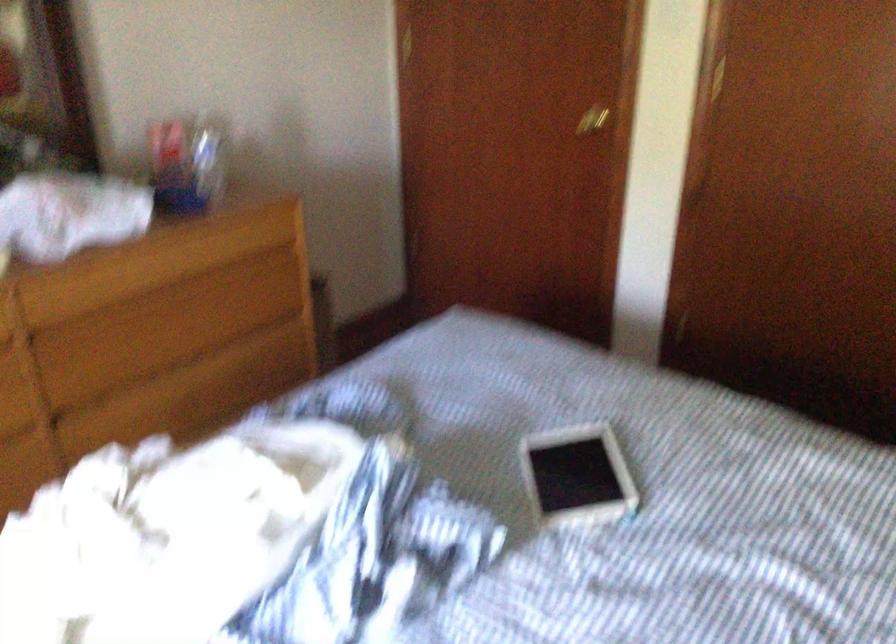
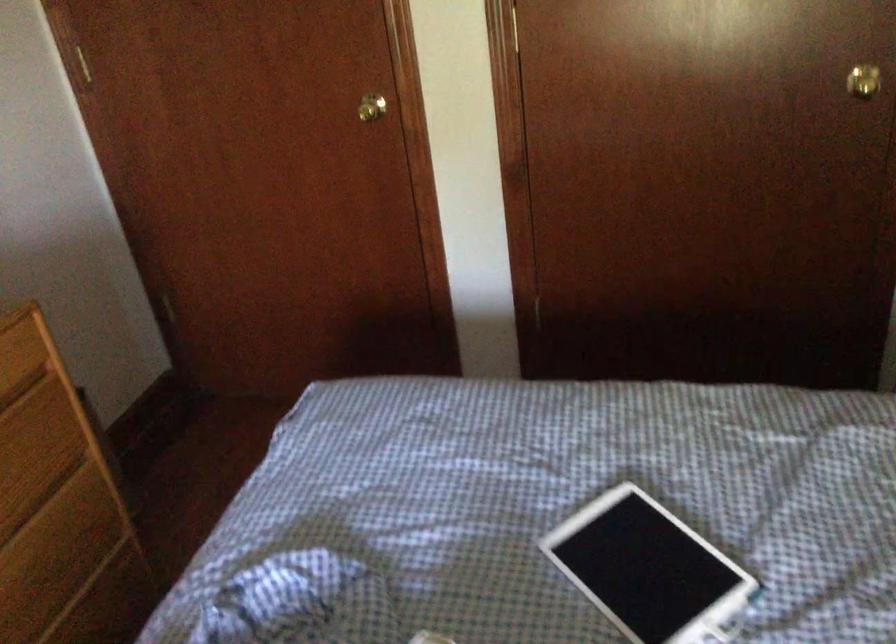
Question: Based on the continuous images, in which direction is the camera rotating? Reply with the corresponding letter.

Choices:
 (A) Left
 (B) Right
 (C) Up
 (D) Down

Answer: (B)